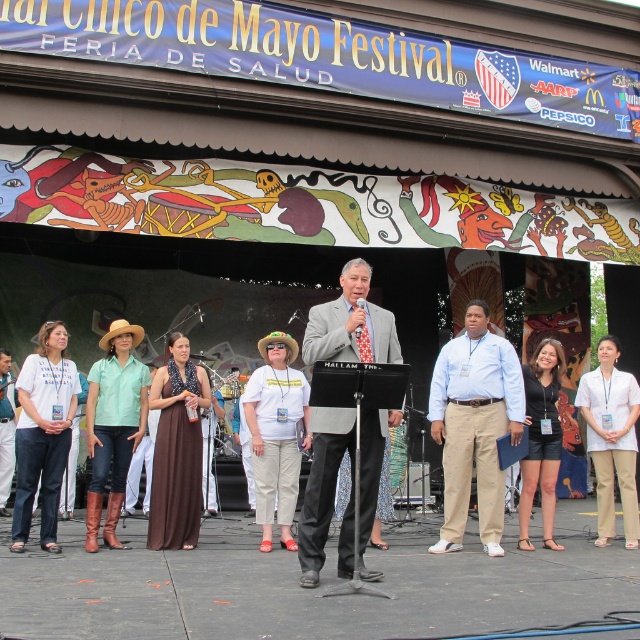
Is white matte t-shirt at center positioned at the back of white smooth pants at center?

No.

Which is above, white matte t-shirt at center or white smooth pants at center?

white matte t-shirt at center is higher up.

Who is more distant from viewer, (289, 401) or (596, 371)?

Positioned behind is point (596, 371).

This screenshot has height=640, width=640. In order to click on white matte t-shirt at center in this screenshot , I will do 276,435.

The width and height of the screenshot is (640, 640). What do you see at coordinates (349, 323) in the screenshot?
I see `matte gray suit at center` at bounding box center [349, 323].

Between matte gray suit at center and light blue shirt at center, which one has less height?

Standing shorter between the two is matte gray suit at center.

Between point (332, 316) and point (480, 305), which one is positioned in front?

Point (332, 316) is more forward.

You are a GUI agent. You are given a task and a screenshot of the screen. Output one action in this format:
    pyautogui.click(x=<x>, y=<y>)
    Task: Click on the matte gray suit at center
    This screenshot has height=640, width=640.
    Given the screenshot: What is the action you would take?
    pos(349,323)

Is matte gray suit at center closer to the viewer compared to white smooth pants at center?

Yes, it is in front of white smooth pants at center.

From the picture: Is matte gray suit at center thinner than white smooth pants at center?

No.

Which is behind, point (385, 410) or point (592, 397)?

The point (592, 397) is behind.

Where is `matte gray suit at center`? This screenshot has width=640, height=640. matte gray suit at center is located at coordinates (349, 323).